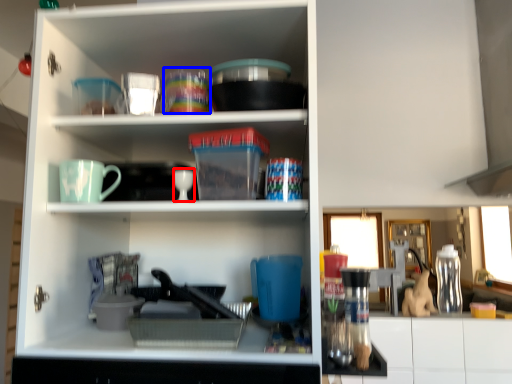
Question: Which object appears farthest to the camera in this image, tableware (highlighted by a red box) or tableware (highlighted by a blue box)?

Choices:
 (A) tableware
 (B) tableware

Answer: (B)